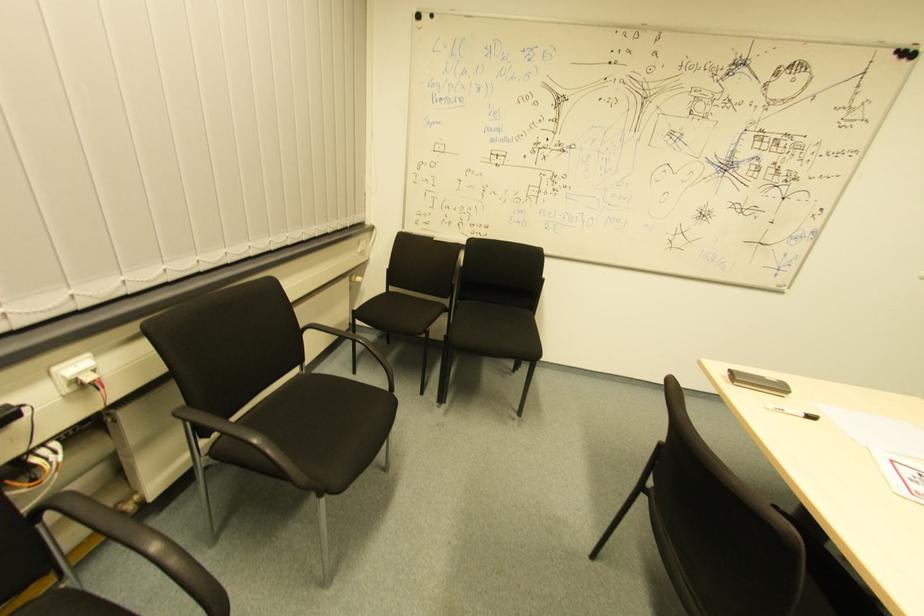
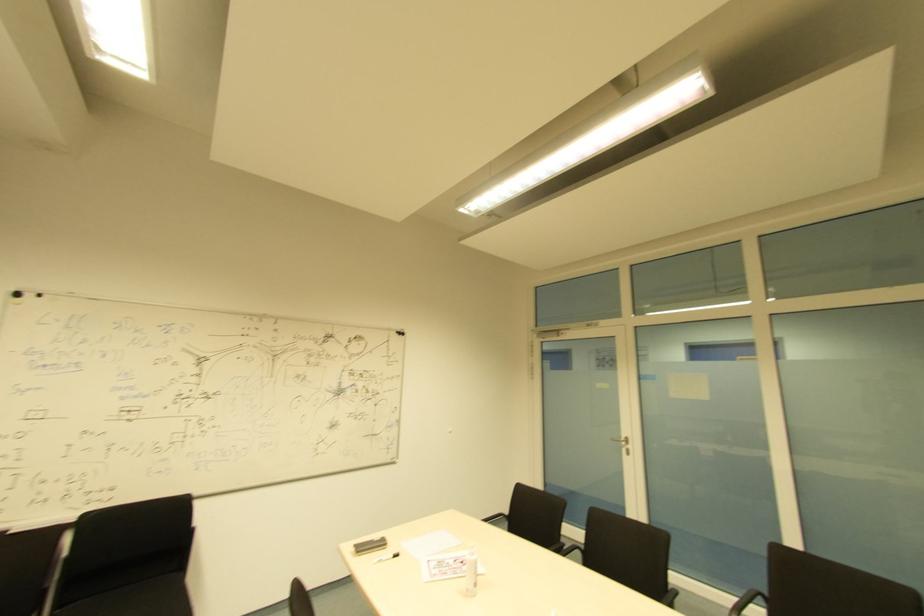
Where in the second image is the point corresponding to point 451,289 from the first image?

(44, 593)